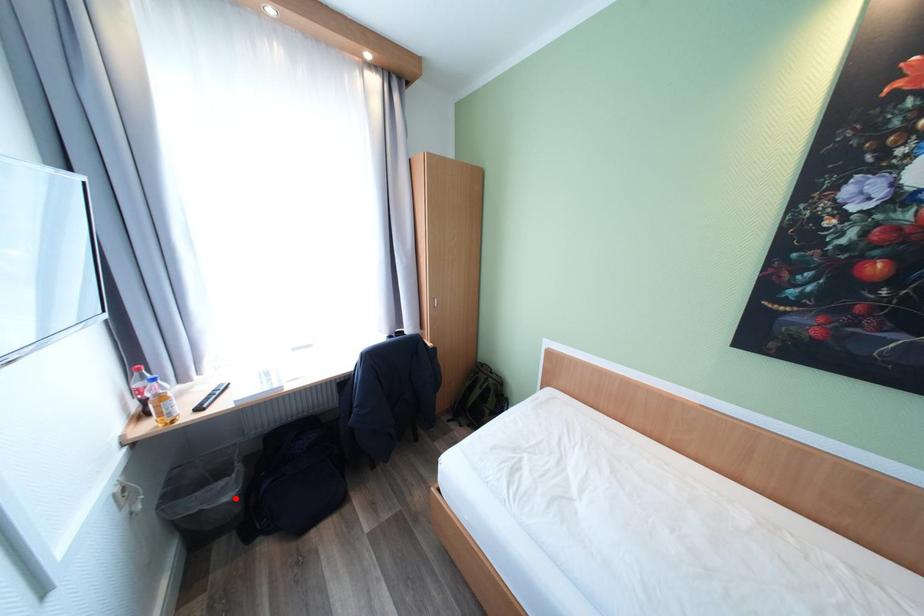
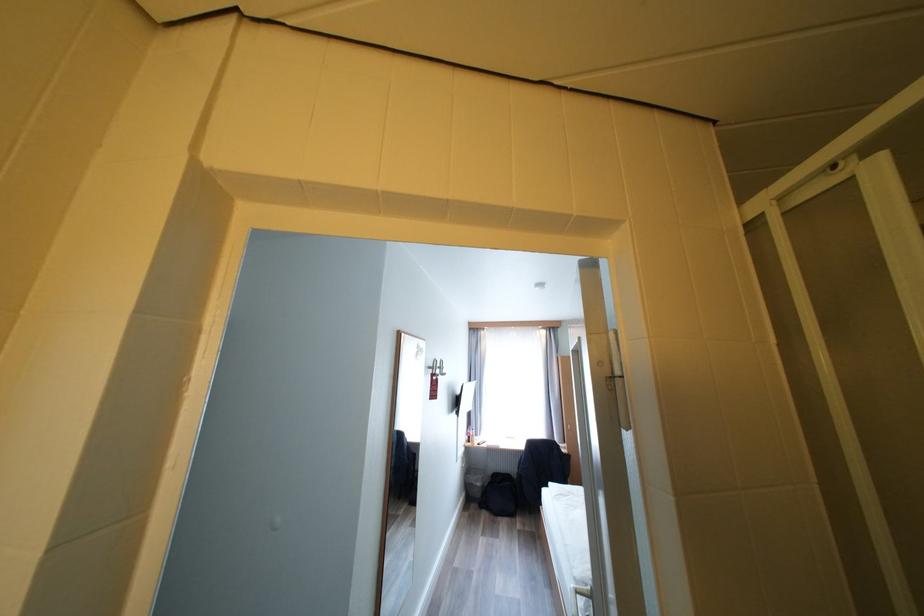
The point at the highlighted location is marked in the first image. Where is the corresponding point in the second image?

(485, 485)